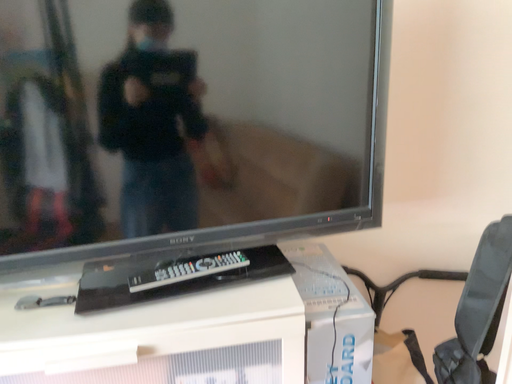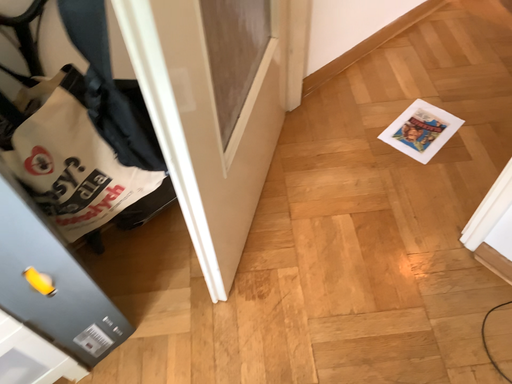
Question: Which way did the camera rotate in the video?

Choices:
 (A) rotated upward
 (B) rotated downward

Answer: (B)